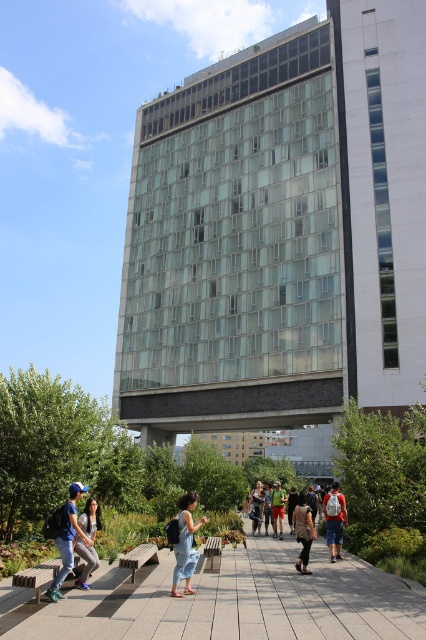
Does light gray concrete pavement at center appear under green fabric shorts at center?

Actually, light gray concrete pavement at center is above green fabric shorts at center.

Which is in front, point (192, 616) or point (273, 506)?

Point (192, 616)

Where is `light gray concrete pavement at center`? This screenshot has height=640, width=426. light gray concrete pavement at center is located at coordinates (238, 600).

Is denim pants at lower left smaller than dark brown leather jacket at center?

Indeed, denim pants at lower left has a smaller size compared to dark brown leather jacket at center.

Does denim pants at lower left appear under dark brown leather jacket at center?

Actually, denim pants at lower left is above dark brown leather jacket at center.

Who is more forward, (92, 541) or (301, 492)?

Point (92, 541)

You are a GUI agent. You are given a task and a screenshot of the screen. Output one action in this format:
    pyautogui.click(x=<x>, y=<y>)
    Task: Click on the denim pants at lower left
    
    Given the screenshot: What is the action you would take?
    pyautogui.click(x=86, y=540)

Can you confirm if denim dress at center is bigger than denim shorts at center?

Yes.

Between denim dress at center and denim shorts at center, which one is positioned lower?

denim shorts at center is lower down.

The image size is (426, 640). Describe the element at coordinates (186, 545) in the screenshot. I see `denim dress at center` at that location.

Image resolution: width=426 pixels, height=640 pixels. I want to click on denim dress at center, so click(186, 545).